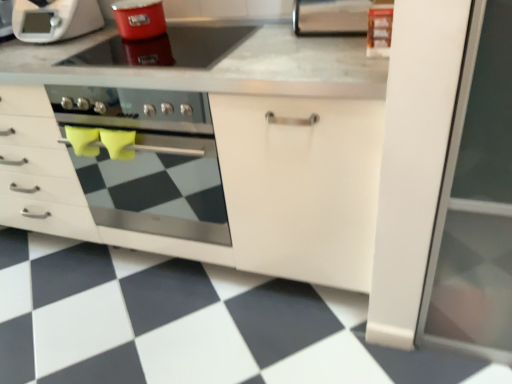
Question: From a real-world perspective, is white matte cabinet at center over metallic stainless steel paper towel holder at upper center?

Choices:
 (A) no
 (B) yes

Answer: (A)

Question: Is white matte cabinet at center taller than metallic stainless steel paper towel holder at upper center?

Choices:
 (A) yes
 (B) no

Answer: (A)

Question: Does white matte cabinet at center appear on the right side of metallic stainless steel paper towel holder at upper center?

Choices:
 (A) yes
 (B) no

Answer: (B)

Question: Would you say white matte cabinet at center contains metallic stainless steel paper towel holder at upper center?

Choices:
 (A) yes
 (B) no

Answer: (B)

Question: Is white matte cabinet at center oriented towards metallic stainless steel paper towel holder at upper center?

Choices:
 (A) no
 (B) yes

Answer: (A)

Question: From the image's perspective, relative to white matte cabinet at center, is metallic stainless steel paper towel holder at upper center above or below?

Choices:
 (A) below
 (B) above

Answer: (B)

Question: Considering the positions of metallic stainless steel paper towel holder at upper center and white matte cabinet at center in the image, is metallic stainless steel paper towel holder at upper center taller or shorter than white matte cabinet at center?

Choices:
 (A) short
 (B) tall

Answer: (A)

Question: Is metallic stainless steel paper towel holder at upper center bigger or smaller than white matte cabinet at center?

Choices:
 (A) big
 (B) small

Answer: (B)

Question: Based on their positions, is metallic stainless steel paper towel holder at upper center located to the left or right of white matte cabinet at center?

Choices:
 (A) left
 (B) right

Answer: (B)

Question: Is point pyautogui.click(x=38, y=18) positioned closer to the camera than point pyautogui.click(x=184, y=228)?

Choices:
 (A) farther
 (B) closer

Answer: (A)

Question: Looking at their shapes, would you say white matte microwave at upper left is wider or thinner than white matte cabinet at center?

Choices:
 (A) wide
 (B) thin

Answer: (B)

Question: Is white matte microwave at upper left to the left or to the right of white matte cabinet at center in the image?

Choices:
 (A) left
 (B) right

Answer: (A)

Question: Is white matte microwave at upper left inside the boundaries of white matte cabinet at center, or outside?

Choices:
 (A) inside
 (B) outside

Answer: (B)

Question: Is shiny red pot at upper center wider or thinner than metallic stainless steel paper towel holder at upper center?

Choices:
 (A) wide
 (B) thin

Answer: (A)

Question: Does point (146, 54) appear closer or farther from the camera than point (351, 34)?

Choices:
 (A) closer
 (B) farther

Answer: (B)